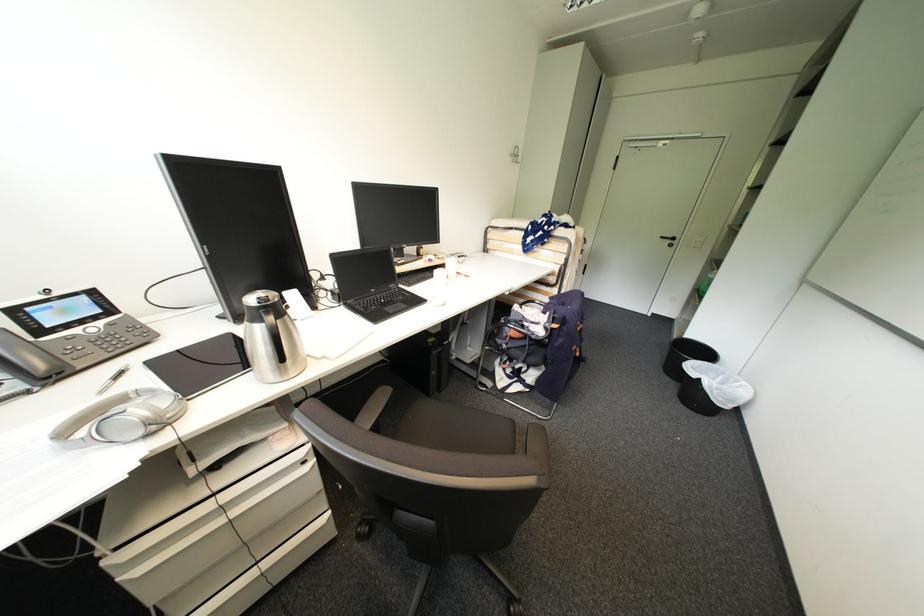
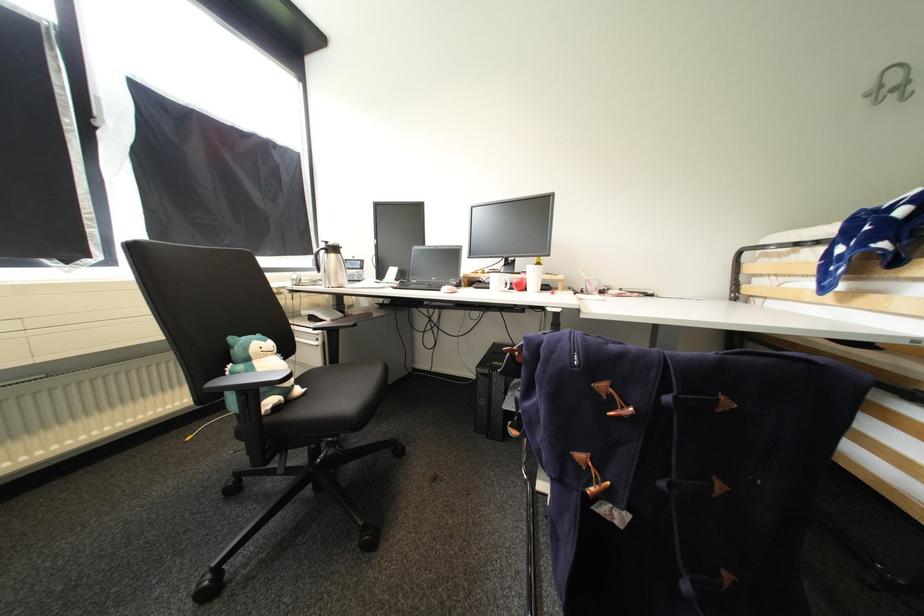
The point at (524, 158) is marked in the first image. Where is the corresponding point in the second image?

(912, 84)